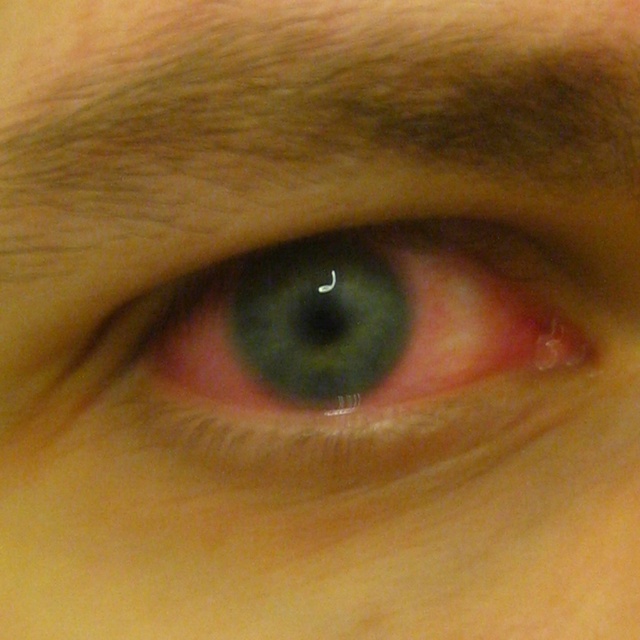
Question: Which point is closer to the camera?

Choices:
 (A) brown fuzzy eyebrow at upper center
 (B) green matte eye at center

Answer: (A)

Question: Is brown fuzzy eyebrow at upper center in front of green matte eye at center?

Choices:
 (A) no
 (B) yes

Answer: (B)

Question: In this image, where is brown fuzzy eyebrow at upper center located relative to green matte eye at center?

Choices:
 (A) right
 (B) left

Answer: (B)

Question: Is brown fuzzy eyebrow at upper center further to the viewer compared to green matte eye at center?

Choices:
 (A) yes
 (B) no

Answer: (B)